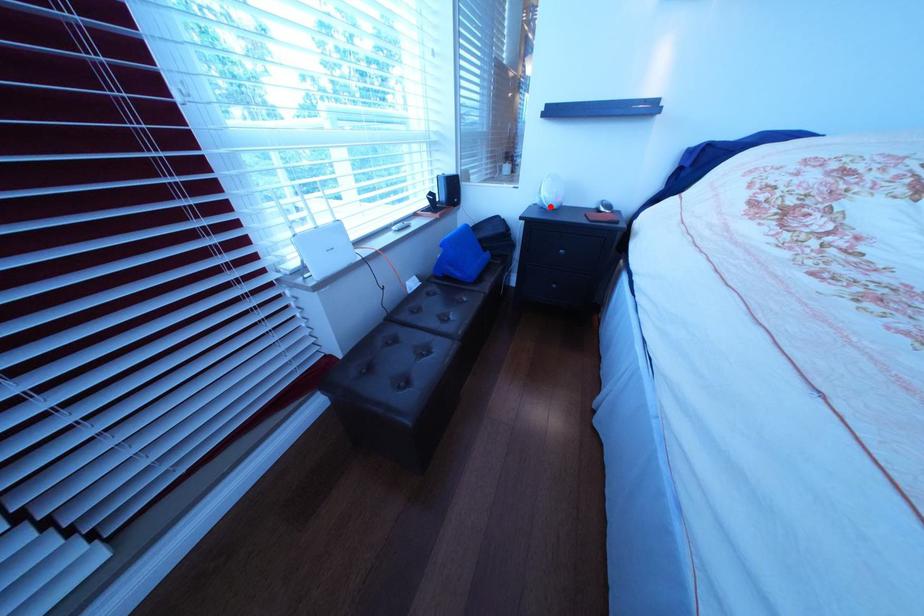
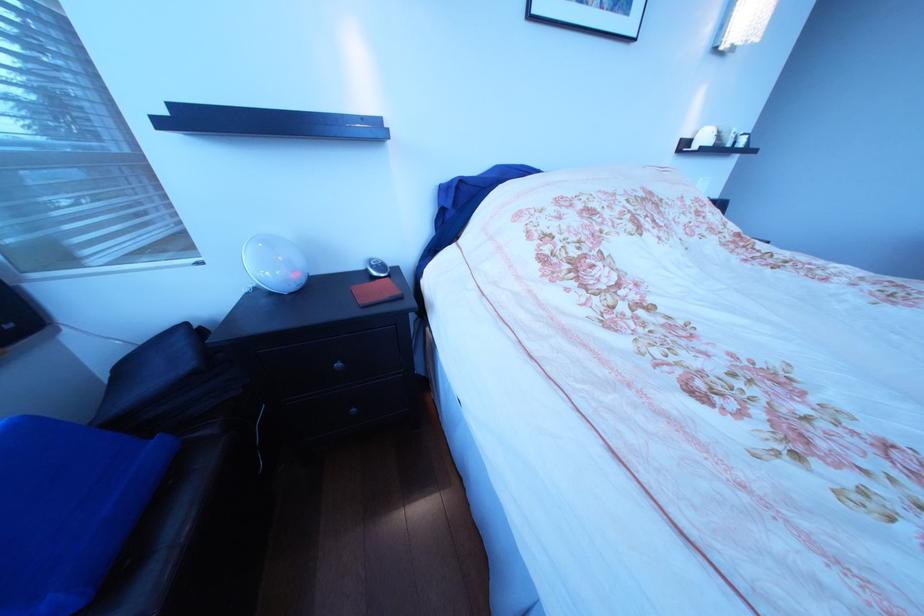
The point at the highlighted location is marked in the first image. Where is the corresponding point in the second image?

(272, 291)